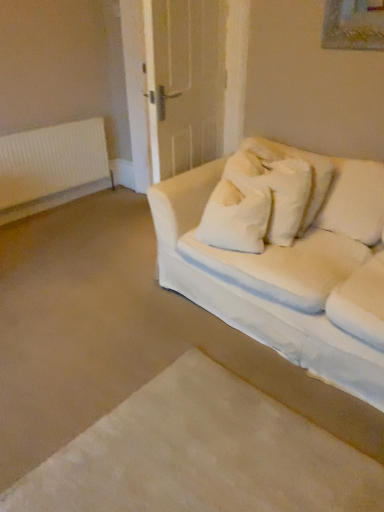
Find the location of `spots to the right of white plastic radiator at left`. spots to the right of white plastic radiator at left is located at coordinates (110, 209).